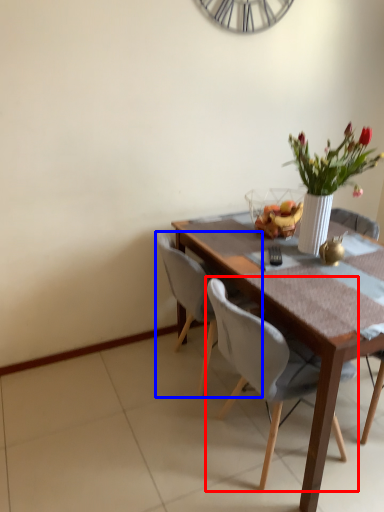
Question: Which of the following is the farthest to the observer, chair (highlighted by a red box) or chair (highlighted by a blue box)?

Choices:
 (A) chair
 (B) chair

Answer: (B)